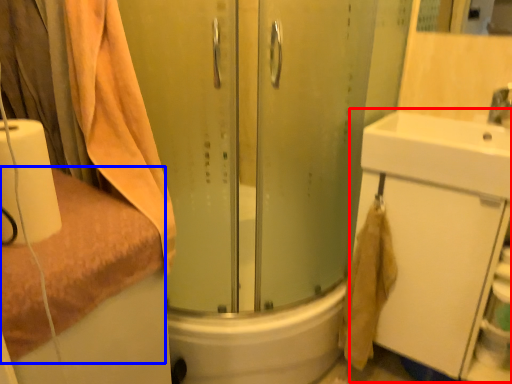
Question: Which of the following is the farthest to the observer, bathroom cabinet (highlighted by a red box) or towel (highlighted by a blue box)?

Choices:
 (A) bathroom cabinet
 (B) towel

Answer: (A)